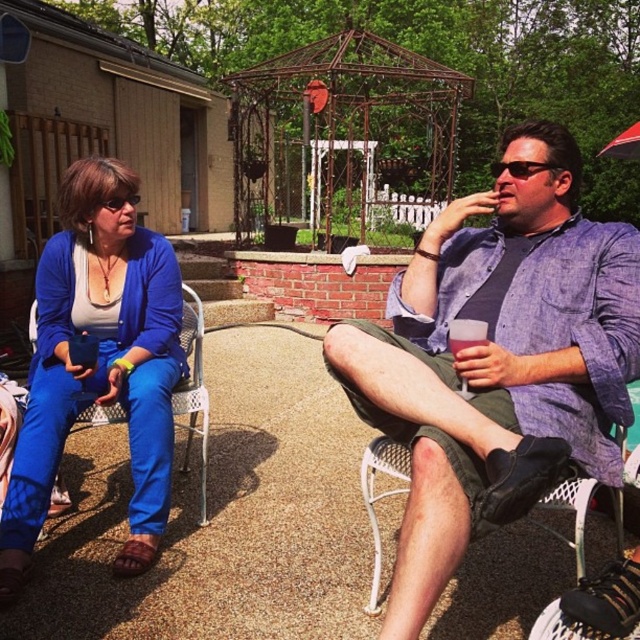
The image size is (640, 640). I want to click on matte blue pants at left, so click(99, 360).

Measure the distance from matte blue pants at left to white mesh chair at lower right.

The distance of matte blue pants at left from white mesh chair at lower right is 1.55 meters.

Which is in front, point (67, 186) or point (371, 506)?

Point (371, 506) is more forward.

Locate an element on the screen. matte blue pants at left is located at coordinates 99,360.

Is denim shirt at center positioned at the back of matte blue pants at left?

No, it is not.

Can you confirm if denim shirt at center is positioned to the left of matte blue pants at left?

No, denim shirt at center is not to the left of matte blue pants at left.

The image size is (640, 640). Describe the element at coordinates (497, 358) in the screenshot. I see `denim shirt at center` at that location.

Find the location of a particular element. The image size is (640, 640). denim shirt at center is located at coordinates (497, 358).

Between denim shirt at center and white mesh chair at lower right, which one has more height?

With more height is denim shirt at center.

Who is lower down, denim shirt at center or white mesh chair at lower right?

white mesh chair at lower right

Measure the distance between point (429,417) and camera.

Point (429,417) is 1.36 meters from camera.

I want to click on denim shirt at center, so click(x=497, y=358).